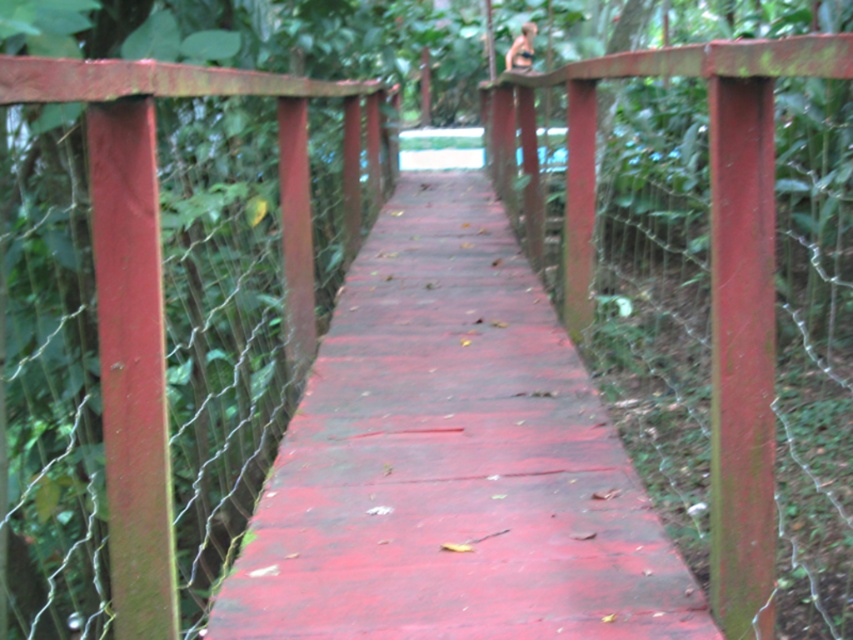
Question: Observing the image, what is the correct spatial positioning of smooth wooden bridge at center in reference to rusty metal fence at upper center?

Choices:
 (A) above
 (B) below

Answer: (B)

Question: Can you confirm if smooth wooden bridge at center is thinner than rusty metal fence at upper center?

Choices:
 (A) no
 (B) yes

Answer: (A)

Question: Does rusty metal fence at upper center appear on the right side of rusty metal fence at left?

Choices:
 (A) yes
 (B) no

Answer: (A)

Question: Which point is farther to the camera?

Choices:
 (A) (682, 65)
 (B) (126, 480)
 (C) (579, 529)

Answer: (C)

Question: Based on their relative distances, which object is nearer to the rusty metal fence at left?

Choices:
 (A) rusty metal fence at upper center
 (B) smooth wooden bridge at center

Answer: (A)

Question: Which of the following is the closest to the observer?

Choices:
 (A) smooth wooden bridge at center
 (B) rusty metal fence at upper center

Answer: (B)